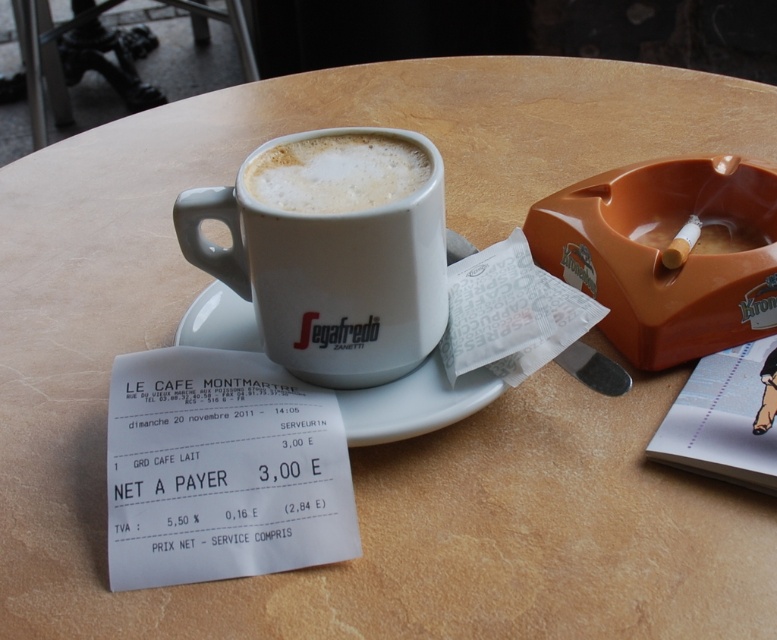
You are a barista trying to place a new cup on the table. The cup you have is 4 inches in diameter. Can you place it on the white ceramic saucer at center without overlapping the white frothy foam at center?

The distance between the white ceramic saucer at center and the white frothy foam at center is 3.56 inches. Since the new cup is 4 inches in diameter, placing it on the saucer would cause overlap with the foam as the cup is larger than the available space.

You are a barista trying to clean the table. You see the white ceramic mug at center and the white frothy foam at center. Which object is located to the right of the other?

The white frothy foam at center is located to the right of the white ceramic mug at center because the mug is on the left side of the foam.

You are a barista who just prepared a drink and needs to place the frothy foam on the saucer. Based on the scene, can you confirm if the white frothy foam at center is already positioned correctly on the white ceramic saucer at center?

The white ceramic saucer at center is to the right of the white frothy foam at center, so the foam is not centered on the saucer. The saucer should be placed under the foam to hold it properly.